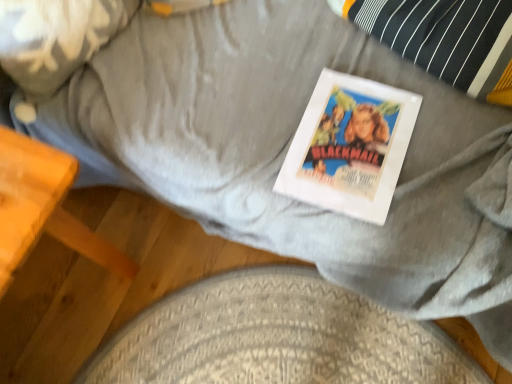
Question: Can you confirm if textured gray dog bed at lower center is bigger than wooden table at lower left?

Choices:
 (A) yes
 (B) no

Answer: (B)

Question: Is textured gray dog bed at lower center positioned with its back to wooden table at lower left?

Choices:
 (A) no
 (B) yes

Answer: (A)

Question: Does textured gray dog bed at lower center have a lesser width compared to wooden table at lower left?

Choices:
 (A) yes
 (B) no

Answer: (A)

Question: Can you confirm if textured gray dog bed at lower center is taller than wooden table at lower left?

Choices:
 (A) yes
 (B) no

Answer: (B)

Question: Does textured gray dog bed at lower center appear on the left side of wooden table at lower left?

Choices:
 (A) yes
 (B) no

Answer: (B)

Question: Relative to textured gray dog bed at lower center, is fluffy white pillow at upper left in front or behind?

Choices:
 (A) behind
 (B) front

Answer: (B)

Question: Is point (106, 8) closer or farther from the camera than point (163, 322)?

Choices:
 (A) farther
 (B) closer

Answer: (B)

Question: In terms of width, does fluffy white pillow at upper left look wider or thinner when compared to textured gray dog bed at lower center?

Choices:
 (A) wide
 (B) thin

Answer: (B)

Question: From a real-world perspective, relative to textured gray dog bed at lower center, is fluffy white pillow at upper left vertically above or below?

Choices:
 (A) below
 (B) above

Answer: (B)

Question: From their relative heights in the image, would you say wooden table at lower left is taller or shorter than fluffy white pillow at upper left?

Choices:
 (A) tall
 (B) short

Answer: (A)

Question: In the image, is wooden table at lower left on the left side or the right side of fluffy white pillow at upper left?

Choices:
 (A) left
 (B) right

Answer: (A)

Question: In the image, is wooden table at lower left positioned in front of or behind fluffy white pillow at upper left?

Choices:
 (A) front
 (B) behind

Answer: (A)

Question: From a real-world perspective, is wooden table at lower left positioned above or below fluffy white pillow at upper left?

Choices:
 (A) below
 (B) above

Answer: (A)

Question: Considering the positions of fluffy white pillow at upper left and white paper at center in the image, is fluffy white pillow at upper left bigger or smaller than white paper at center?

Choices:
 (A) big
 (B) small

Answer: (A)

Question: From the image's perspective, relative to white paper at center, is fluffy white pillow at upper left above or below?

Choices:
 (A) above
 (B) below

Answer: (A)